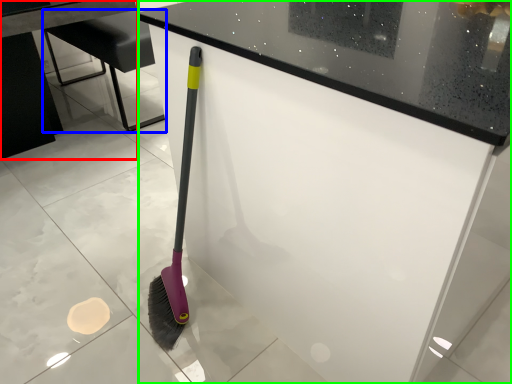
Question: Which object is positioned farthest from table (highlighted by a red box)? Select from furniture (highlighted by a blue box) and counter (highlighted by a green box).

Choices:
 (A) furniture
 (B) counter

Answer: (B)